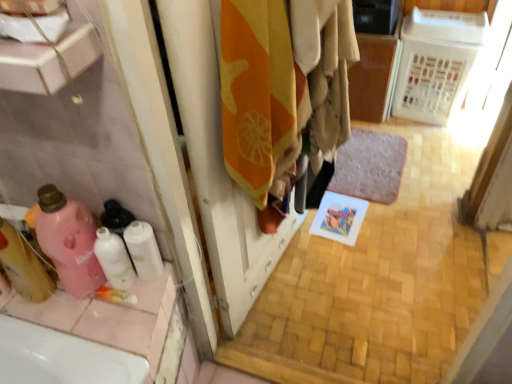
Identify the location of vacant area in front of white plastic laundry basket at upper right. (424, 146).